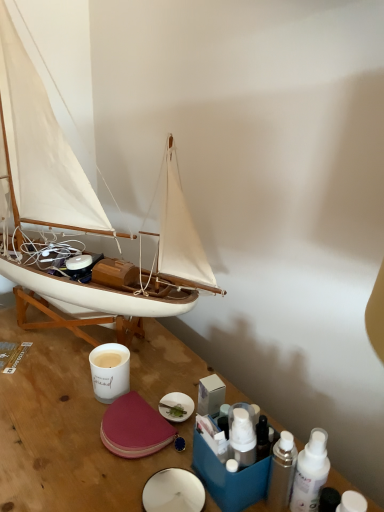
The height and width of the screenshot is (512, 384). What do you see at coordinates (282, 472) in the screenshot?
I see `metallic silver spray can at lower right, positioned as the 3th toiletry in right-to-left order` at bounding box center [282, 472].

Identify the location of metallic silver spray can at lower right, which is the first toiletry from left to right. This screenshot has height=512, width=384. (282, 472).

In order to click on white matte sailboat at left in this screenshot , I will do `click(41, 151)`.

What is the approximate width of metallic silver spray can at lower right, the 2th toiletry in the left-to-right sequence?

It is 1.67 inches.

In order to face wooden table at center, should I rotate leftwards or rightwards?

A 11.586 degree turn to the left will do.

What do you see at coordinates (65, 432) in the screenshot? This screenshot has height=512, width=384. I see `wooden table at center` at bounding box center [65, 432].

This screenshot has height=512, width=384. I want to click on white matte bottle at lower right, which appears as the 3th toiletry when viewed from the left, so click(352, 502).

Do you think wooden table at center is within white matte sailboat at left, or outside of it?

wooden table at center is located beyond the bounds of white matte sailboat at left.

Would you say wooden table at center is a long distance from white matte sailboat at left?

They are positioned close to each other.

From the image's perspective, relative to wooden table at center, is metallic silver spray can at lower right, the 2th toiletry in the left-to-right sequence, above or below?

metallic silver spray can at lower right, the 2th toiletry in the left-to-right sequence, is situated higher than wooden table at center in the image.

Where is `table below the metallic silver spray can at lower right, the second toiletry in the right-to-left sequence (from the image's perspective)`? table below the metallic silver spray can at lower right, the second toiletry in the right-to-left sequence (from the image's perspective) is located at coordinates (65, 432).

Based on the photo, which is more to the right, metallic silver spray can at lower right, the 2th toiletry in the left-to-right sequence, or wooden table at center?

metallic silver spray can at lower right, the 2th toiletry in the left-to-right sequence.

Which object is closer to the camera, wooden table at center or metallic silver spray can at lower right, the 2th toiletry in the left-to-right sequence?

wooden table at center is closer to the camera.

From a real-world perspective, is wooden table at center positioned under metallic silver spray can at lower right, the second toiletry in the right-to-left sequence, based on gravity?

Correct, in the physical world, wooden table at center is lower than metallic silver spray can at lower right, the second toiletry in the right-to-left sequence.

Does wooden table at center have a lesser height compared to metallic silver spray can at lower right, the 2th toiletry in the left-to-right sequence?

No.

Is wooden table at center bigger or smaller than metallic silver spray can at lower right, the 2th toiletry in the left-to-right sequence?

In the image, wooden table at center appears to be larger than metallic silver spray can at lower right, the 2th toiletry in the left-to-right sequence.

The image size is (384, 512). Find the location of `the 3rd toiletry counting from the right side of the wooden table at center`. the 3rd toiletry counting from the right side of the wooden table at center is located at coordinates (x=352, y=502).

Which object is wider, wooden table at center or white matte bottle at lower right, which appears as the 3th toiletry when viewed from the left?

wooden table at center.

Is wooden table at center situated inside white matte bottle at lower right, marked as the first toiletry in a right-to-left arrangement, or outside?

wooden table at center lies outside white matte bottle at lower right, marked as the first toiletry in a right-to-left arrangement.

Measure the distance between white matte sailboat at left and metallic silver spray can at lower right, the 2th toiletry in the left-to-right sequence.

white matte sailboat at left is 54.92 centimeters away from metallic silver spray can at lower right, the 2th toiletry in the left-to-right sequence.

Is white matte sailboat at left facing towards metallic silver spray can at lower right, the 2th toiletry in the left-to-right sequence?

No, white matte sailboat at left is not turned towards metallic silver spray can at lower right, the 2th toiletry in the left-to-right sequence.

Considering the relative positions of white matte sailboat at left and metallic silver spray can at lower right, the second toiletry in the right-to-left sequence, in the image provided, is white matte sailboat at left to the left or to the right of metallic silver spray can at lower right, the second toiletry in the right-to-left sequence,?

white matte sailboat at left is positioned on metallic silver spray can at lower right, the second toiletry in the right-to-left sequence,'s left side.

Based on the photo, from a real-world perspective, is white matte sailboat at left on top of metallic silver spray can at lower right, the 2th toiletry in the left-to-right sequence?

Yes.

Is point (10, 59) closer to viewer compared to point (93, 379)?

Yes, point (10, 59) is in front of point (93, 379).

From a real-world perspective, is white matte sailboat at left positioned above or below white matte cup at center?

In terms of real-world spatial position, white matte sailboat at left is above white matte cup at center.

Considering the sizes of white matte sailboat at left and white matte cup at center in the image, is white matte sailboat at left taller or shorter than white matte cup at center?

In the image, white matte sailboat at left appears to be taller than white matte cup at center.

Is white matte cup at center located within white matte sailboat at left?

Absolutely, white matte cup at center is inside white matte sailboat at left.

Considering their positions, is white matte cup at center located in front of or behind white matte sailboat at left?

In the image, white matte cup at center appears behind white matte sailboat at left.

Which of these two, white matte cup at center or white matte sailboat at left, is smaller?

With smaller size is white matte cup at center.

I want to click on coffee cup that appears on the right of white matte sailboat at left, so click(x=110, y=371).

From the image's perspective, which is below, white matte cup at center or white matte sailboat at left?

white matte cup at center is shown below in the image.

Find the location of a particular element. Image resolution: width=384 pixels, height=512 pixels. boat located above the wooden table at center (from the image's perspective) is located at coordinates (41, 151).

Where is `toiletry that is the 2nd one when counting backward from the wooden table at center`? The image size is (384, 512). toiletry that is the 2nd one when counting backward from the wooden table at center is located at coordinates (310, 473).

Based on their spatial positions, is metallic silver spray can at lower right, the second toiletry in the right-to-left sequence, or white matte sailboat at left further from white matte cup at center?

Based on the image, metallic silver spray can at lower right, the second toiletry in the right-to-left sequence, appears to be further to white matte cup at center.

When comparing their distances from white matte sailboat at left, does metallic silver spray can at lower right, which is the first toiletry from left to right, or white matte bottle at lower right, marked as the first toiletry in a right-to-left arrangement, seem closer?

metallic silver spray can at lower right, which is the first toiletry from left to right, lies closer to white matte sailboat at left than the other object.

Which object lies further to the anchor point white matte sailboat at left, white matte bottle at lower right, which appears as the 3th toiletry when viewed from the left, or wooden table at center?

white matte bottle at lower right, which appears as the 3th toiletry when viewed from the left.

Considering their positions, is metallic silver spray can at lower right, which is the first toiletry from left to right, positioned closer to metallic silver spray can at lower right, the second toiletry in the right-to-left sequence, than wooden table at center?

Based on the image, metallic silver spray can at lower right, which is the first toiletry from left to right, appears to be nearer to metallic silver spray can at lower right, the second toiletry in the right-to-left sequence.

Based on their spatial positions, is wooden table at center or white matte sailboat at left closer to white matte cup at center?

wooden table at center is closer to white matte cup at center.

From the image, which object appears to be farther from metallic silver spray can at lower right, the 2th toiletry in the left-to-right sequence, white matte cup at center or white matte bottle at lower right, which appears as the 3th toiletry when viewed from the left?

white matte cup at center.

Based on the photo, when comparing their distances from wooden table at center, does white matte sailboat at left or metallic silver spray can at lower right, the second toiletry in the right-to-left sequence, seem closer?

white matte sailboat at left.

Which object lies further to the anchor point metallic silver spray can at lower right, the second toiletry in the right-to-left sequence, white matte cup at center or wooden table at center?

white matte cup at center is further to metallic silver spray can at lower right, the second toiletry in the right-to-left sequence.

Where is `coffee cup between white matte sailboat at left and metallic silver spray can at lower right, the second toiletry in the right-to-left sequence, in the up-down direction`? coffee cup between white matte sailboat at left and metallic silver spray can at lower right, the second toiletry in the right-to-left sequence, in the up-down direction is located at coordinates (110, 371).

Find the location of a particular element. coffee cup between wooden table at center and white matte bottle at lower right, marked as the first toiletry in a right-to-left arrangement, in the horizontal direction is located at coordinates (110, 371).

The width and height of the screenshot is (384, 512). Identify the location of coffee cup between white matte sailboat at left and metallic silver spray can at lower right, positioned as the 3th toiletry in right-to-left order, in the vertical direction. (110, 371).

Locate an element on the screen. toiletry between white matte sailboat at left and metallic silver spray can at lower right, positioned as the 3th toiletry in right-to-left order, from top to bottom is located at coordinates (310, 473).